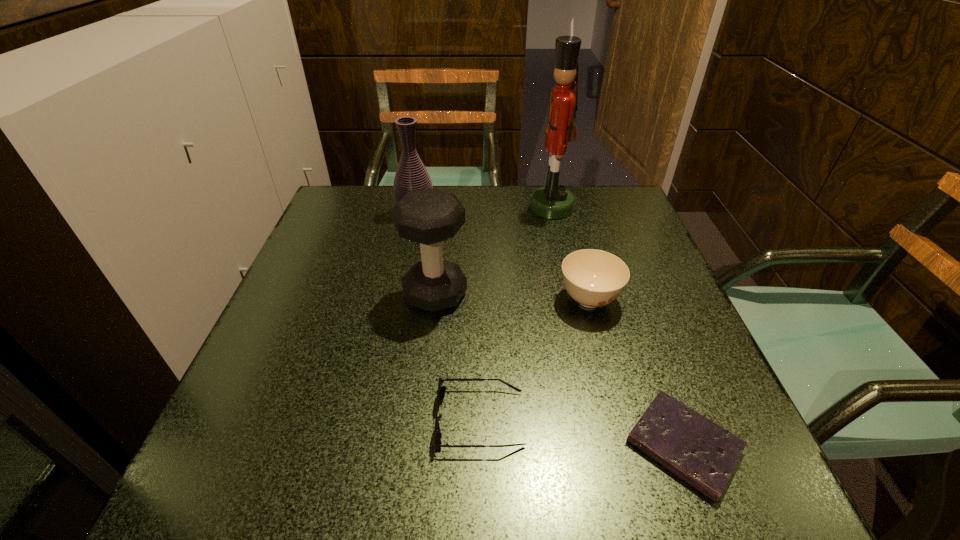
Find the location of a particular element. Image resolution: width=960 pixels, height=540 pixels. blank region between the shortest object and the vase is located at coordinates coord(549,329).

Locate an element on the screen. This screenshot has height=540, width=960. free space between the tallest object and the shortest object is located at coordinates (617, 327).

Identify which object is the fourth nearest to the vase. Please provide its 2D coordinates. Your answer should be formatted as a tuple, i.e. [(x, y)], where the tuple contains the x and y coordinates of a point satisfying the conditions above.

[(441, 389)]

Select which object appears as the fifth closest to the third shortest object. Please provide its 2D coordinates. Your answer should be formatted as a tuple, i.e. [(x, y)], where the tuple contains the x and y coordinates of a point satisfying the conditions above.

[(411, 175)]

Locate an element on the screen. vacant region that satisfies the following two spatial constraints: 1. on the front-facing side of the diary; 2. on the left side of the sunglasses is located at coordinates (480, 446).

At what (x,y) coordinates should I click in order to perform the action: click on blank space that satisfies the following two spatial constraints: 1. on the front-facing side of the shortest object; 2. on the right side of the nutcracker. Please return your answer as a coordinate pair (x, y). Looking at the image, I should click on (606, 446).